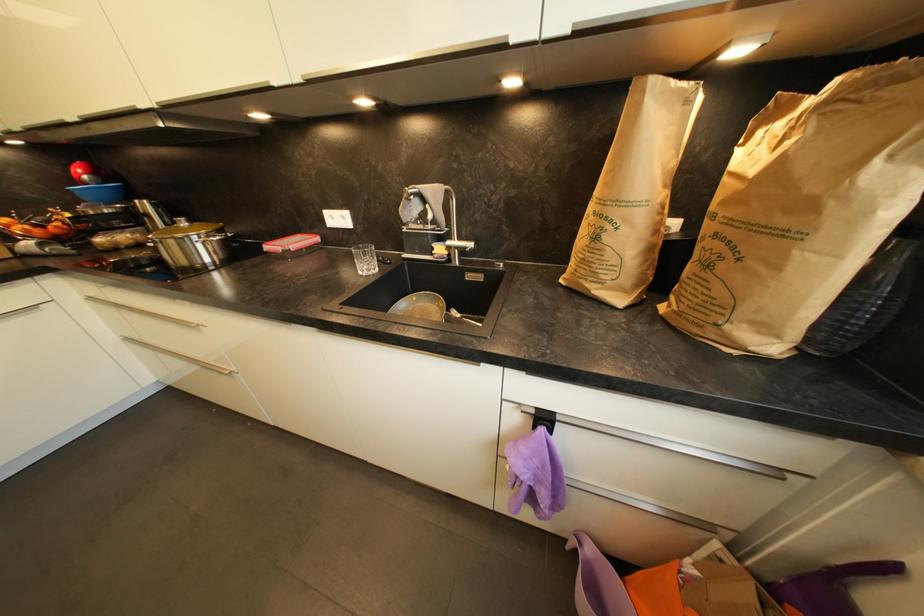
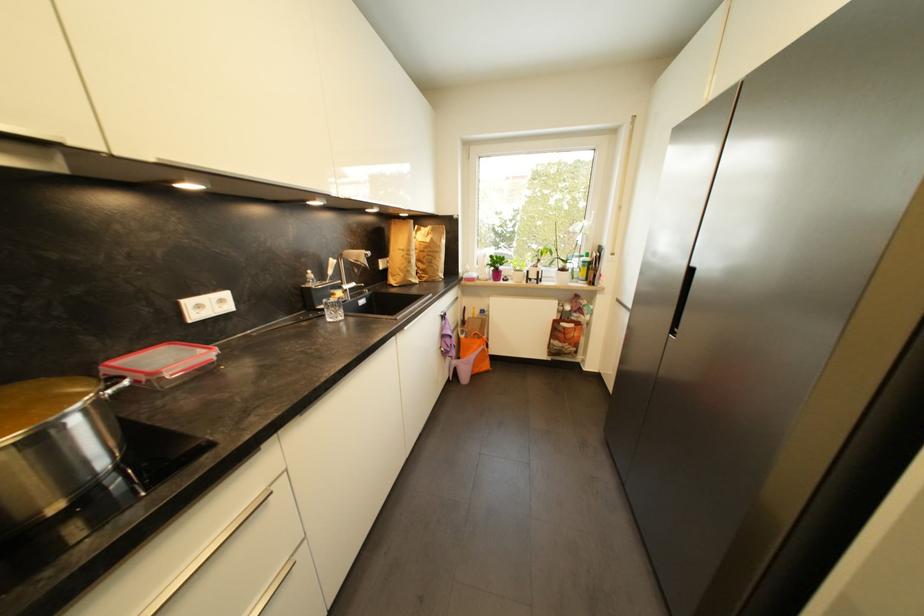
The point at (x=697, y=569) is marked in the first image. Where is the corresponding point in the second image?

(468, 339)